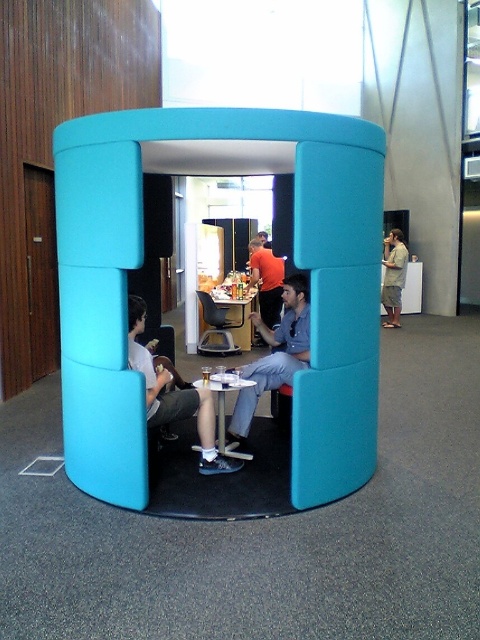
Question: Which point is farther to the camera?

Choices:
 (A) (249, 413)
 (B) (244, 317)
 (C) (247, 384)

Answer: (B)

Question: Is matte gray pants at center positioned in front of matte plastic chair at center?

Choices:
 (A) no
 (B) yes

Answer: (B)

Question: Can you confirm if matte plastic chair at center is bigger than metallic silver table at center?

Choices:
 (A) yes
 (B) no

Answer: (B)

Question: Among these points, which one is farthest from the camera?

Choices:
 (A) (250, 426)
 (B) (210, 339)

Answer: (B)

Question: Is denim shirt at center wider than orange shirt at center?

Choices:
 (A) yes
 (B) no

Answer: (A)

Question: Which object is farther from the camera taking this photo?

Choices:
 (A) matte gray pants at center
 (B) orange shirt at center
 (C) light brown shorts at right

Answer: (C)